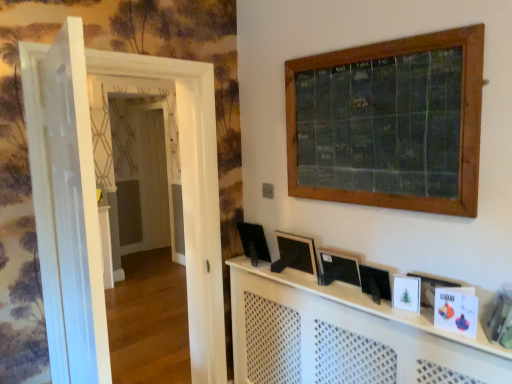
Question: Is white matte picture frame at lower right, the 3th picture frame in the left-to-right sequence, in front of or behind black plastic computer screen at center in the image?

Choices:
 (A) behind
 (B) front

Answer: (B)

Question: Is white matte picture frame at lower right, placed as the 1th picture frame when sorted from front to back, inside the boundaries of black plastic computer screen at center, or outside?

Choices:
 (A) outside
 (B) inside

Answer: (A)

Question: Which object is positioned closest to the black plastic computer screen at center?

Choices:
 (A) black matte picture frame at center, the second picture frame in the back-to-front sequence
 (B) white perforated wood at center
 (C) white glossy door at left, placed as the first door when sorted from front to back
 (D) green slate window at upper center
 (E) black matte picture frame at center, acting as the first picture frame starting from the back

Answer: (E)

Question: Which object is positioned farthest from the black matte picture frame at center, marked as the third picture frame in a front-to-back arrangement?

Choices:
 (A) green slate window at upper center
 (B) black matte picture frame at center, the second picture frame positioned from the front
 (C) white glossy door at left, positioned as the 2th door in front-to-back order
 (D) black plastic computer screen at center
 (E) white perforated wood at center

Answer: (C)